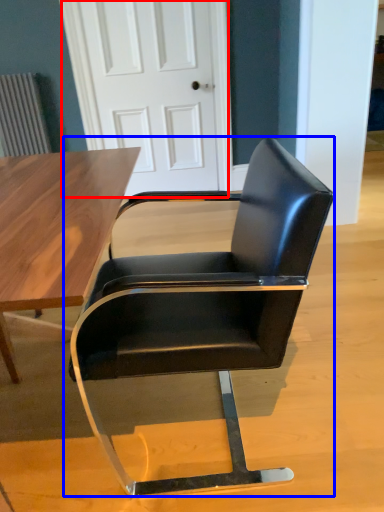
Question: Which object is closer to the camera taking this photo, door (highlighted by a red box) or chair (highlighted by a blue box)?

Choices:
 (A) door
 (B) chair

Answer: (B)